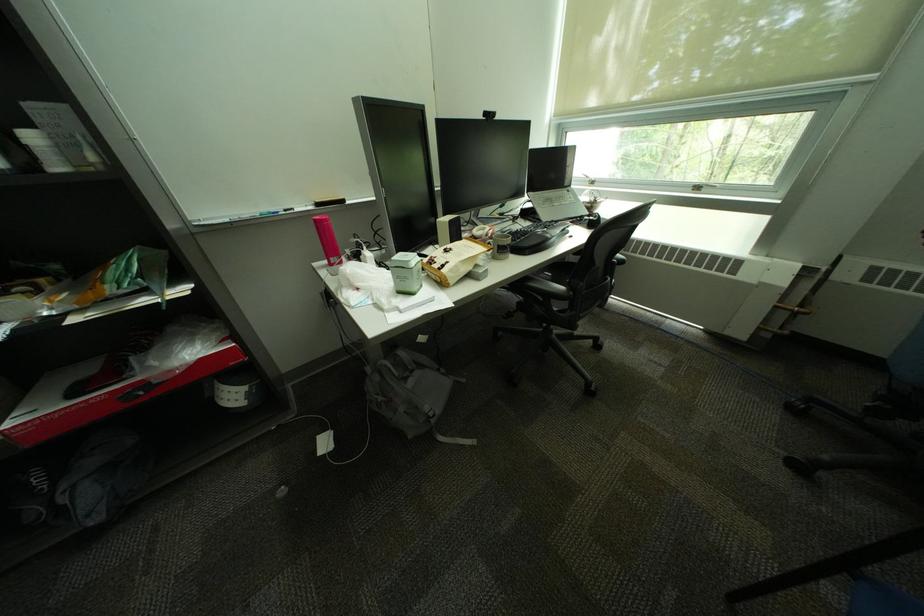
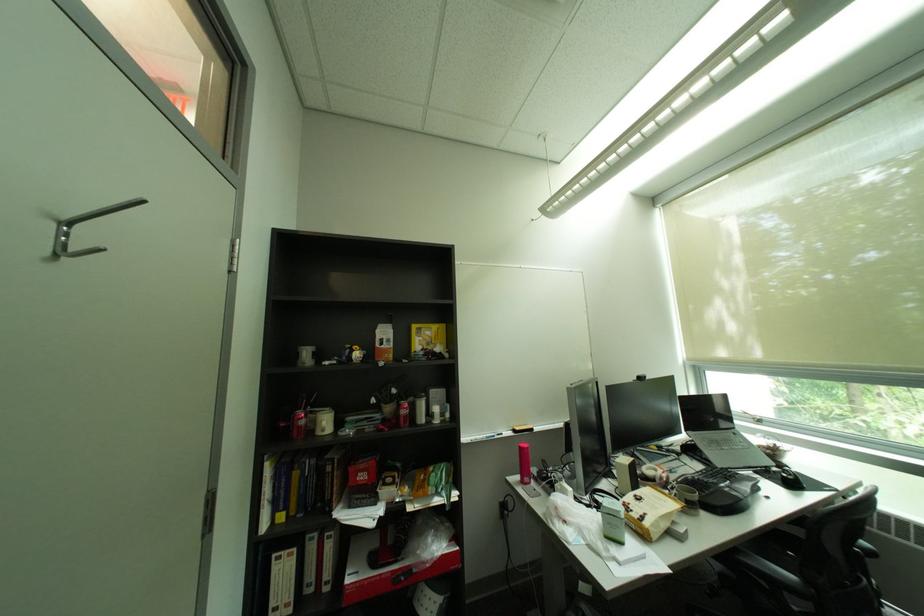
Locate, in the second image, the point that corresponds to [563,302] in the first image.

(796, 594)